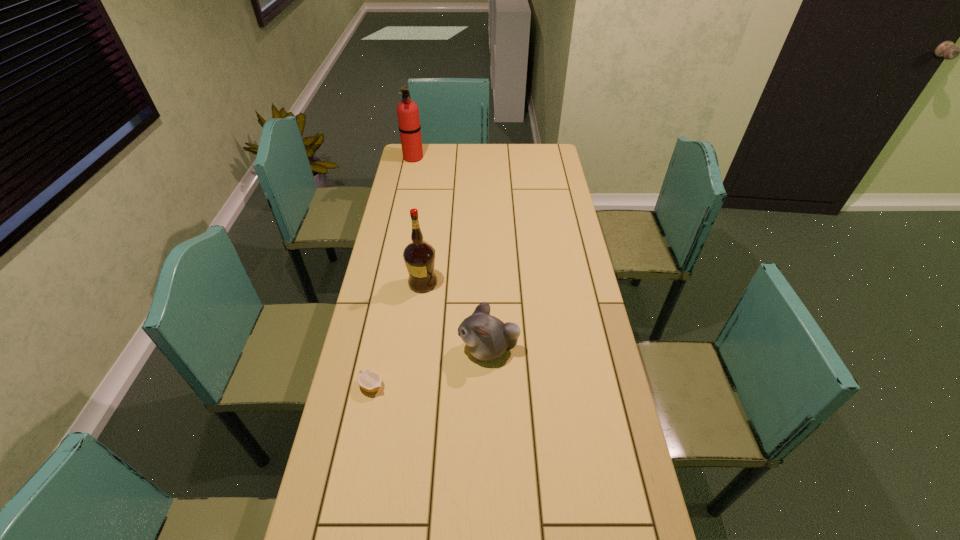
Image resolution: width=960 pixels, height=540 pixels. I want to click on vacant region between the lemon and the farthest object, so click(393, 272).

Identify which object is the third closest to the fire extinguisher. Please provide its 2D coordinates. Your answer should be formatted as a tuple, i.e. [(x, y)], where the tuple contains the x and y coordinates of a point satisfying the conditions above.

[(369, 380)]

Find the location of `object that is the third closest to the lemon`. object that is the third closest to the lemon is located at coordinates click(x=408, y=113).

You are a GUI agent. You are given a task and a screenshot of the screen. Output one action in this format:
    pyautogui.click(x=<x>, y=<y>)
    Task: Click on the vacant space that satisfies the following two spatial constraints: 1. at the nozzle of the fire extinguisher; 2. on the right side of the shortest object
    The image size is (960, 540).
    Given the screenshot: What is the action you would take?
    pyautogui.click(x=366, y=386)

Where is `free space in the image that satisfies the following two spatial constraints: 1. on the back side of the shortest object; 2. at the nozzle of the farthest object`? This screenshot has height=540, width=960. free space in the image that satisfies the following two spatial constraints: 1. on the back side of the shortest object; 2. at the nozzle of the farthest object is located at coordinates (417, 157).

Locate an element on the screen. The image size is (960, 540). vacant space that satisfies the following two spatial constraints: 1. at the nozzle of the fire extinguisher; 2. on the right side of the lemon is located at coordinates (366, 386).

Where is `vacant area that satisfies the following two spatial constraints: 1. on the back side of the nearest object; 2. at the nozzle of the fire extinguisher`? vacant area that satisfies the following two spatial constraints: 1. on the back side of the nearest object; 2. at the nozzle of the fire extinguisher is located at coordinates (417, 157).

You are a GUI agent. You are given a task and a screenshot of the screen. Output one action in this format:
    pyautogui.click(x=<x>, y=<y>)
    Task: Click on the vacant point that satisfies the following two spatial constraints: 1. at the nozzle of the fire extinguisher; 2. on the back side of the shortest object
    Image resolution: width=960 pixels, height=540 pixels.
    Given the screenshot: What is the action you would take?
    pyautogui.click(x=366, y=386)